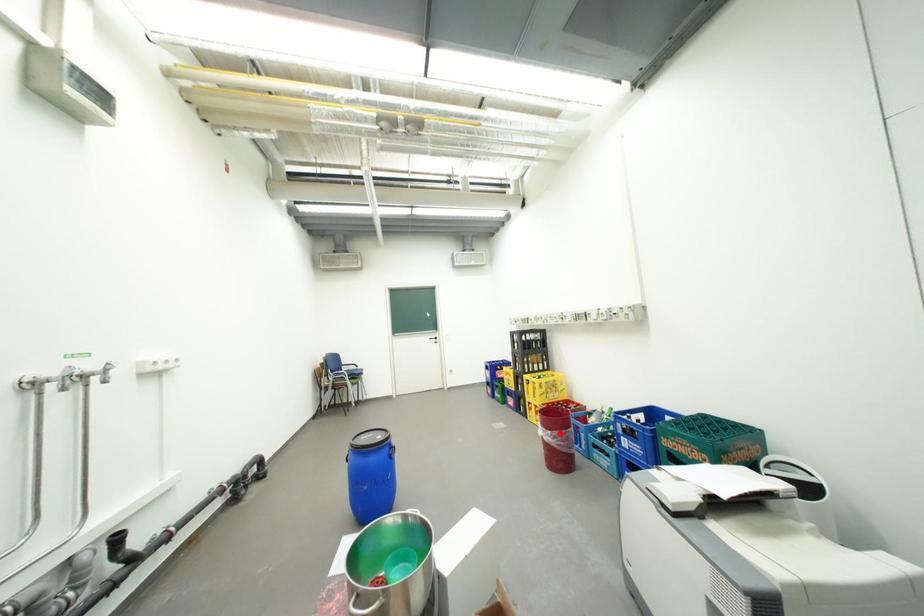
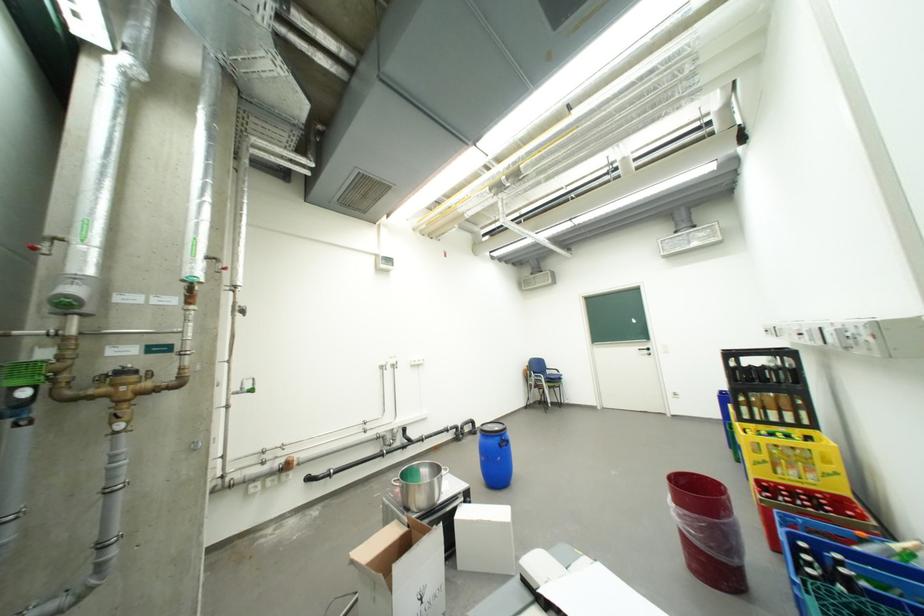
Question: I am providing you with two images of the same scene from different viewpoints. A red point is shown in image1. For the corresponding object point in image2, is it positioned nearer or farther from the camera?

Choices:
 (A) Nearer
 (B) Farther

Answer: (A)